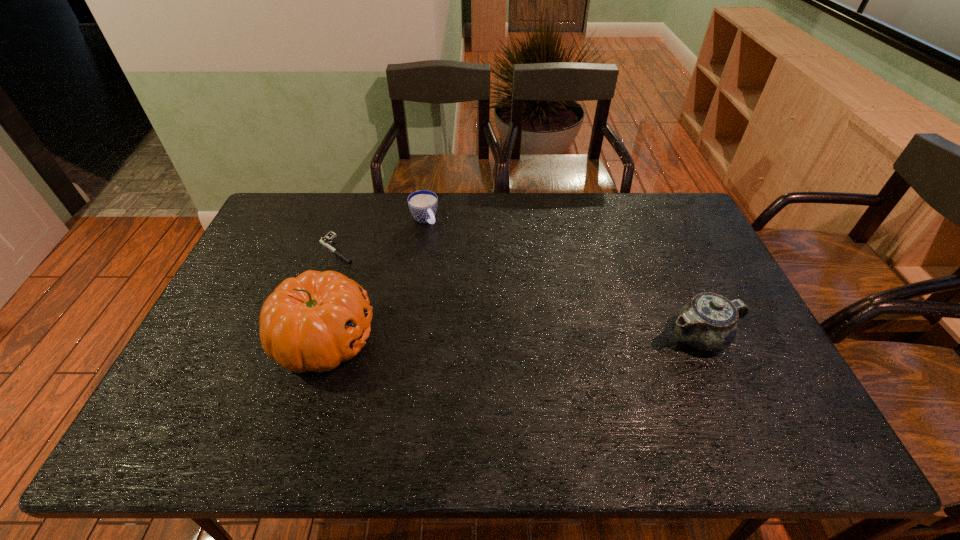
The width and height of the screenshot is (960, 540). Identify the location of vacant space on the desktop that is between the pumpkin and the chinaware and is positioned on the side of the second object from right to left with the handle. (521, 338).

The height and width of the screenshot is (540, 960). I want to click on free space on the desktop that is between the pumpkin and the rightmost object and is positioned on the front-facing side of the pistol, so click(465, 338).